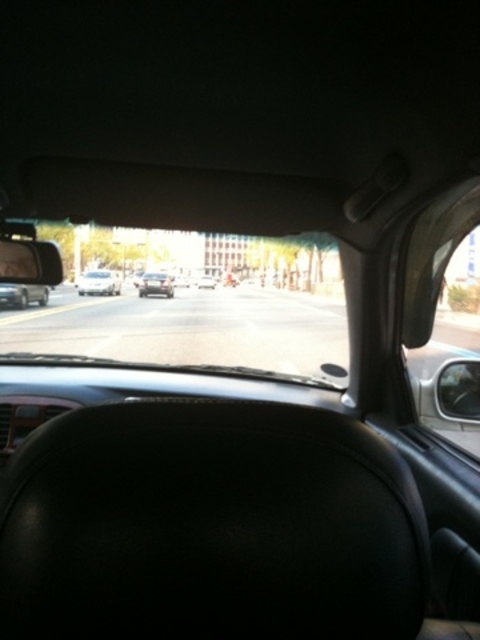
You are a passenger in the car and looking through the windshield. You notice two points marked on the road ahead. The first point is at coordinates point [470,230] and the second is at point [158,288]. Which point is closer to the car?

Point [470,230] is closer to the camera than point [158,288].

You are a passenger in a car and want to see the road ahead clearly. You notice the transparent glass car window at right and the black glossy sedan at center. Which object allows you to see further ahead?

The transparent glass car window at right allows you to see further ahead because it is taller than the black glossy sedan at center, providing a higher vantage point.

You are driving a car and want to know if the point at coordinates point (430,388) is closer to your windshield than the point at point (201,284). Based on the scene, can you determine which point is closer?

Point (430,388) is closer to the camera than point (201,284), so yes, the point at coordinates point (430,388) is closer to your windshield.